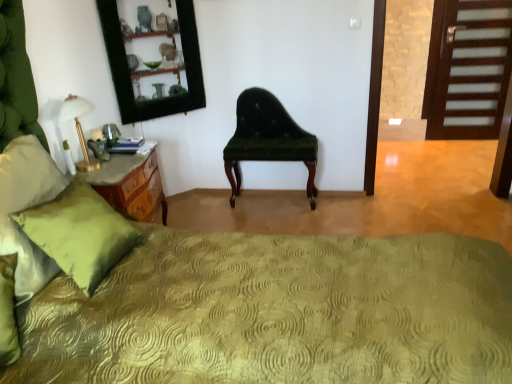
Question: Considering the positions of green textured pillow at left and green glass mirror at upper left in the image, is green textured pillow at left bigger or smaller than green glass mirror at upper left?

Choices:
 (A) small
 (B) big

Answer: (A)

Question: From a real-world perspective, relative to green glass mirror at upper left, is green textured pillow at left vertically above or below?

Choices:
 (A) above
 (B) below

Answer: (B)

Question: Estimate the real-world distances between objects in this image. Which object is farther from the green textured bedspread at center?

Choices:
 (A) white glass table lamp at left
 (B) green glass mirror at upper left
 (C) green polished wood nightstand at left
 (D) velvet green chair at center
 (E) green textured pillow at left

Answer: (B)

Question: Which is farther from the dark wood door at right?

Choices:
 (A) velvet green chair at center
 (B) green textured pillow at left
 (C) green polished wood nightstand at left
 (D) green glass mirror at upper left
 (E) green textured bedspread at center

Answer: (B)